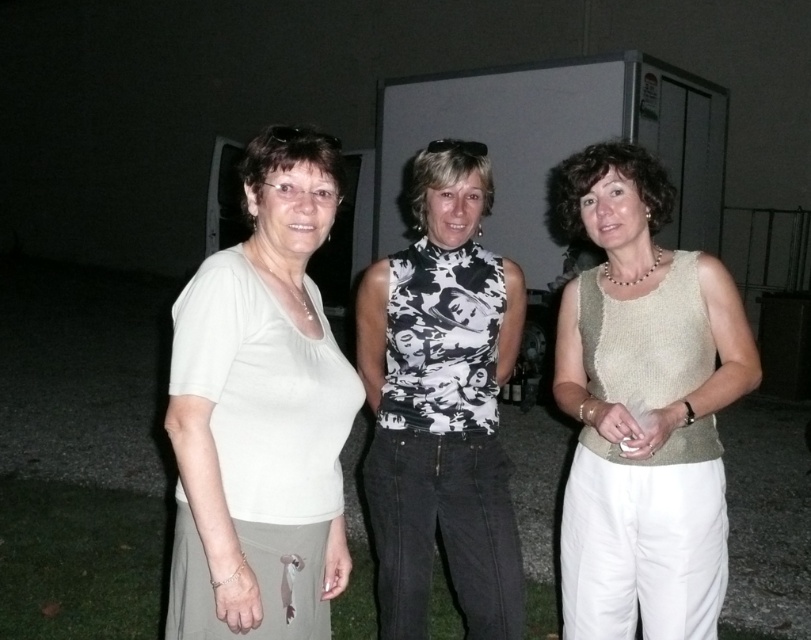
You are standing at the point marked as point [194,278] and want to walk to the point marked as point [697,563]. Which direction should you move to reach your destination?

You should move backward because point [194,278] is in front of point [697,563], so to reach the latter, you need to go in the opposite direction.